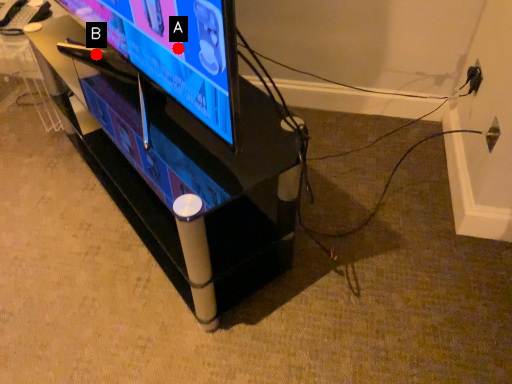
Question: Two points are circled on the image, labeled by A and B beside each circle. Which point is further to the camera?

Choices:
 (A) A is further
 (B) B is further

Answer: (B)